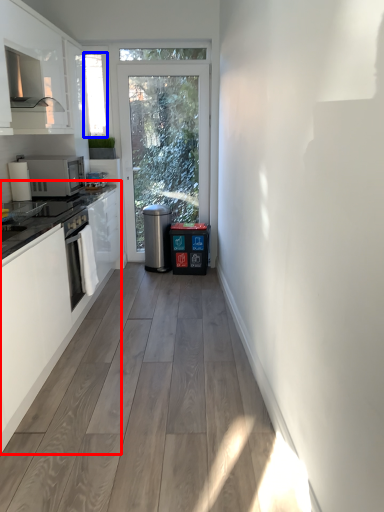
Question: Which object is closer to the camera taking this photo, cabinetry (highlighted by a red box) or window screen (highlighted by a blue box)?

Choices:
 (A) cabinetry
 (B) window screen

Answer: (A)